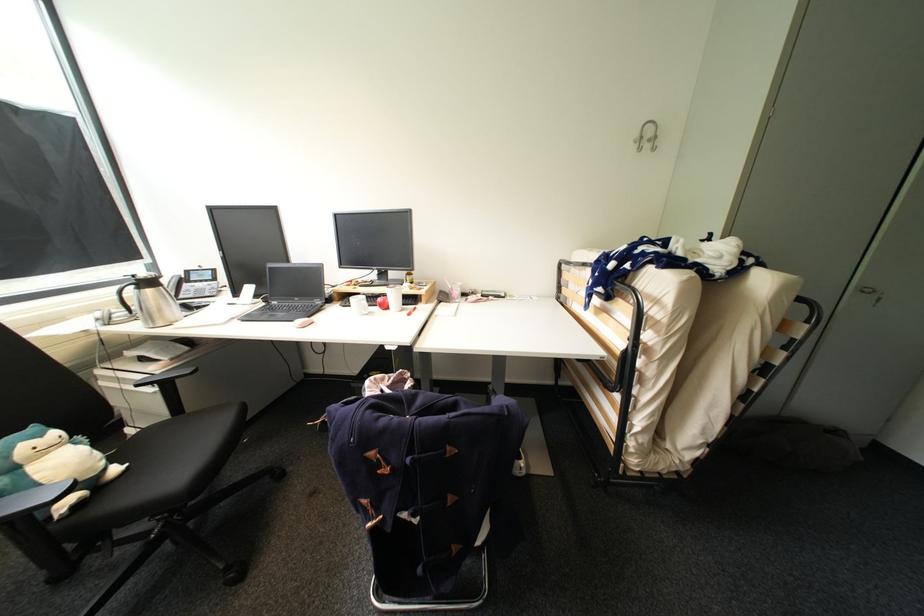
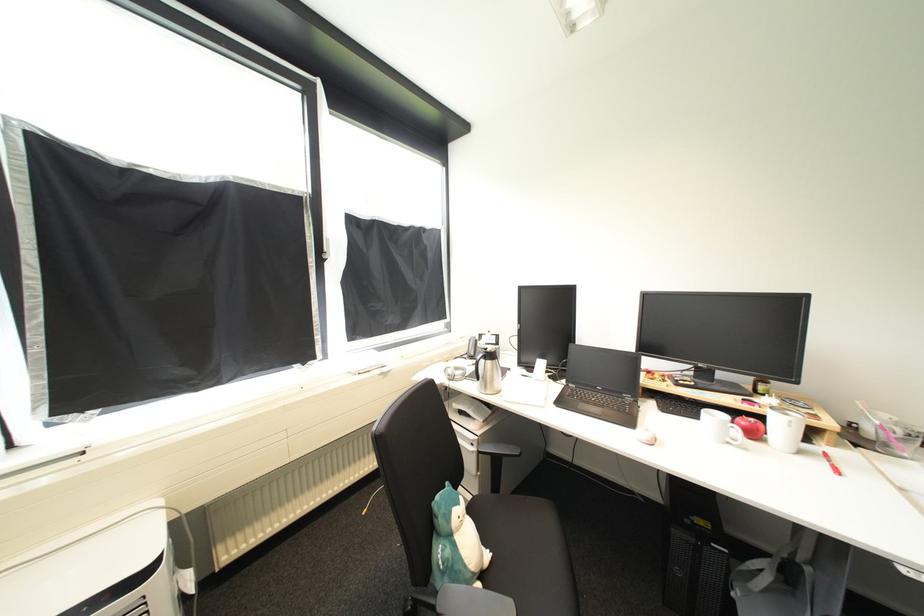
In the second image, find the point that corresponds to (392,307) in the first image.

(761, 436)